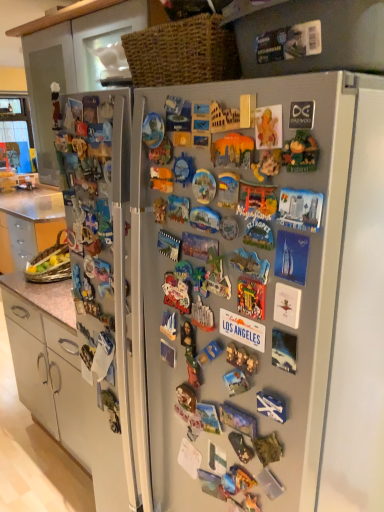
Question: Is multicolored plastic toy at center, which is counted as the seventh toy, starting from the left, closer to camera compared to satin silver fridge at center?

Choices:
 (A) no
 (B) yes

Answer: (B)

Question: Is multicolored plastic toy at center, which is counted as the seventh toy, starting from the left, outside of satin silver fridge at center?

Choices:
 (A) no
 (B) yes

Answer: (B)

Question: From the image's perspective, is multicolored plastic toy at center, the 4th toy in the right-to-left sequence, below satin silver fridge at center?

Choices:
 (A) no
 (B) yes

Answer: (A)

Question: Is multicolored plastic toy at center, the 4th toy in the right-to-left sequence, smaller than satin silver fridge at center?

Choices:
 (A) yes
 (B) no

Answer: (A)

Question: Is multicolored plastic toy at center, which is counted as the seventh toy, starting from the left, aimed at satin silver fridge at center?

Choices:
 (A) no
 (B) yes

Answer: (A)

Question: Does multicolored plastic toy at center, which is counted as the seventh toy, starting from the left, have a lesser width compared to satin silver fridge at center?

Choices:
 (A) yes
 (B) no

Answer: (A)

Question: Can you confirm if matte plastic magnet at center, which is the sixth toy in right-to-left order, is wider than white plastic toy at center, the 8th toy when ordered from right to left?

Choices:
 (A) yes
 (B) no

Answer: (B)

Question: From the image's perspective, would you say matte plastic magnet at center, which is the sixth toy in right-to-left order, is shown under white plastic toy at center, positioned as the 3th toy in left-to-right order?

Choices:
 (A) yes
 (B) no

Answer: (B)

Question: Is white plastic toy at center, positioned as the 3th toy in left-to-right order, at the back of matte plastic magnet at center, the 5th toy viewed from the left?

Choices:
 (A) no
 (B) yes

Answer: (A)

Question: Can you confirm if matte plastic magnet at center, the 5th toy viewed from the left, is thinner than white plastic toy at center, positioned as the 3th toy in left-to-right order?

Choices:
 (A) no
 (B) yes

Answer: (B)

Question: Is the surface of matte plastic magnet at center, the 5th toy viewed from the left, in direct contact with white plastic toy at center, positioned as the 3th toy in left-to-right order?

Choices:
 (A) yes
 (B) no

Answer: (B)

Question: Does matte plastic magnet at center, which is the sixth toy in right-to-left order, have a lesser height compared to white plastic toy at center, positioned as the 3th toy in left-to-right order?

Choices:
 (A) no
 (B) yes

Answer: (B)

Question: Is matte plastic magnet at center, the 5th toy viewed from the left, at the left side of matte plastic magnet at center, which is the third toy from right to left?

Choices:
 (A) no
 (B) yes

Answer: (B)